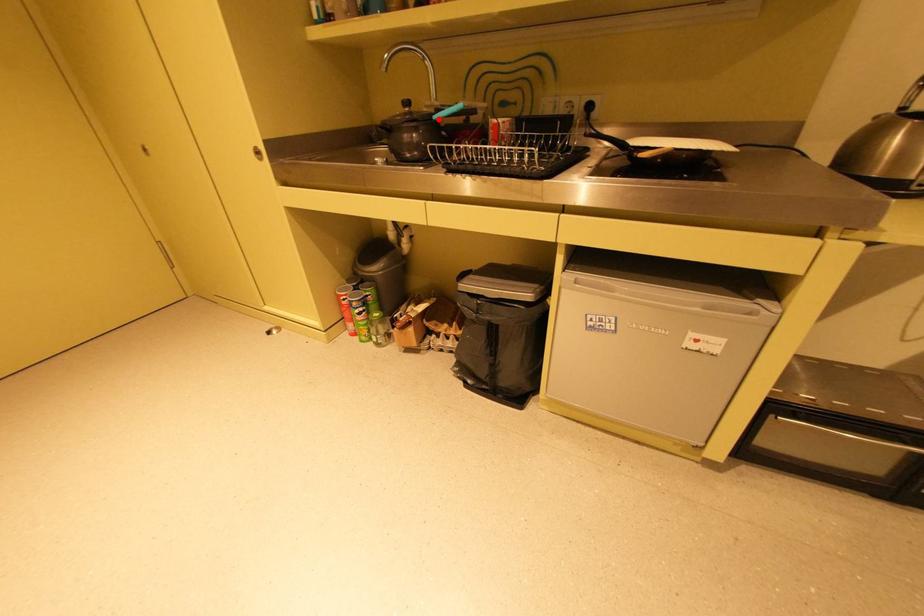
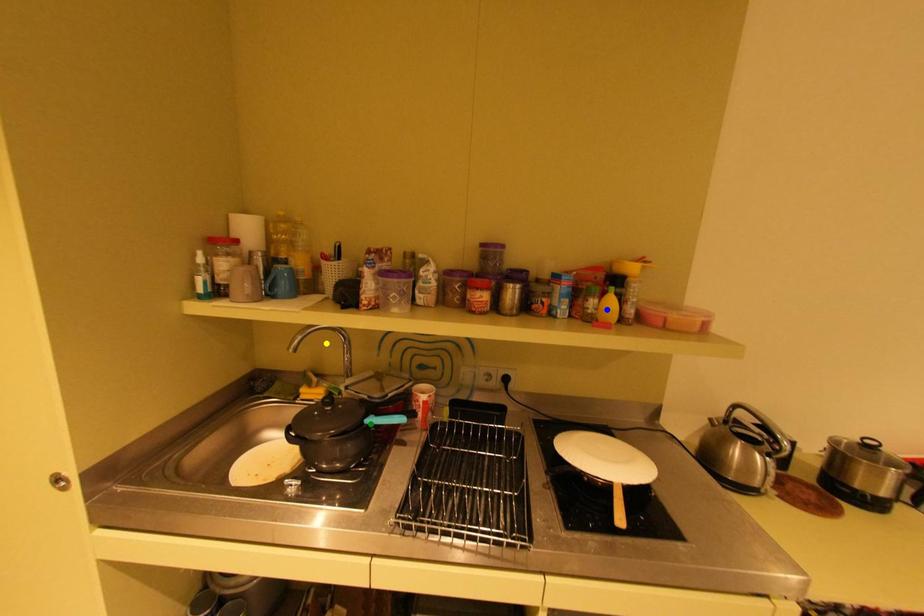
Question: I am providing you with two images of the same scene from different viewpoints. A red point is marked on the first image. You are given multiple points on the second image. In image 2, which mark is for the same physical point as the one in image 1?

Choices:
 (A) green point
 (B) blue point
 (C) yellow point

Answer: (A)